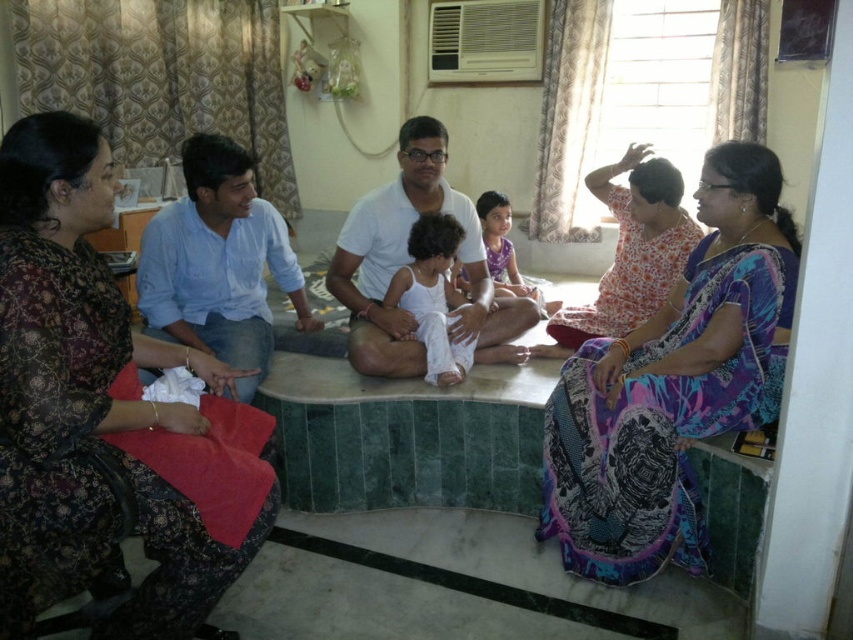
Question: Which object is the farthest from the floral print dress at upper right?

Choices:
 (A) printed silk saree at right
 (B) white cotton shirt at center

Answer: (A)

Question: Does white cotton shirt at center appear on the right side of floral print dress at upper right?

Choices:
 (A) no
 (B) yes

Answer: (A)

Question: Does dark floral dress at left come in front of printed silk saree at right?

Choices:
 (A) no
 (B) yes

Answer: (B)

Question: Which of these objects is positioned closest to the dark floral dress at left?

Choices:
 (A) printed silk saree at right
 (B) white cotton shirt at center
 (C) floral print dress at upper right

Answer: (B)

Question: Which point appears closest to the camera in this image?

Choices:
 (A) (688, 227)
 (B) (741, 388)

Answer: (B)

Question: In this image, where is dark floral dress at left located relative to floral print dress at upper right?

Choices:
 (A) above
 (B) below

Answer: (B)